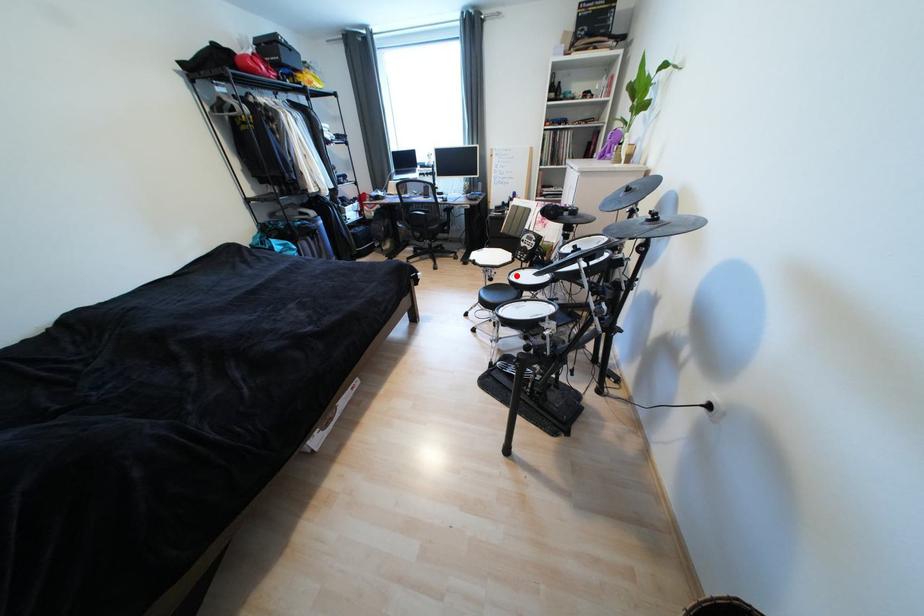
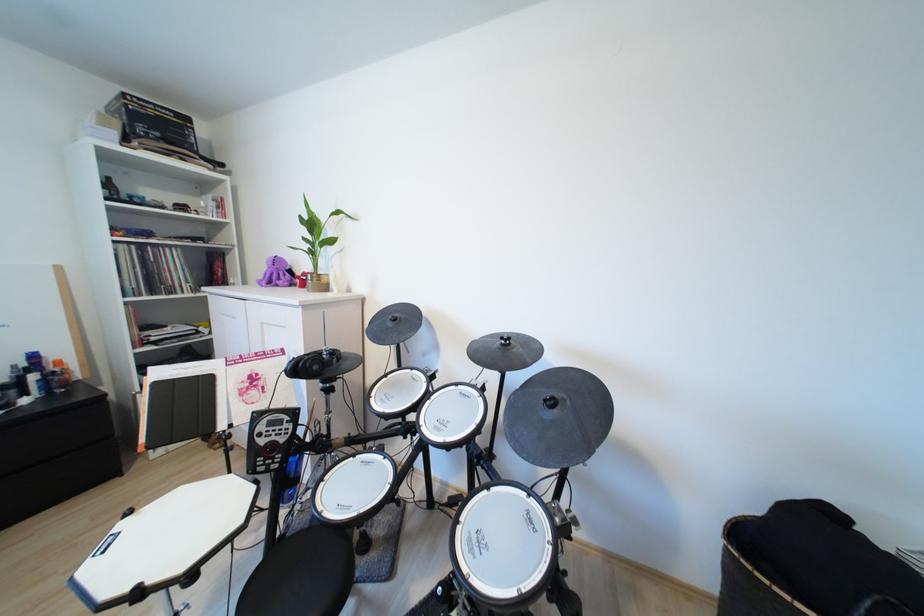
Where in the second image is the point corresponding to the highlighted location from the first image?

(326, 515)